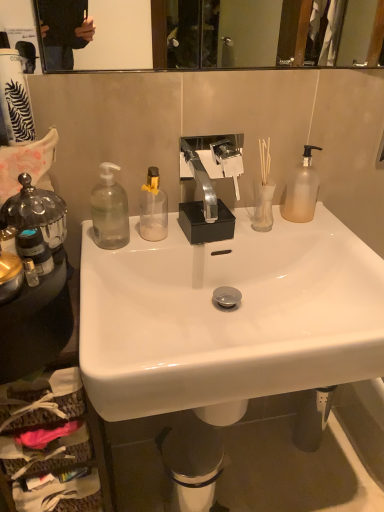
Question: Is transparent glass bottle at center, the second bottle in the left-to-right sequence, facing away from frosted glass pump bottle at upper right, which ranks as the 1th bottle in right-to-left order?

Choices:
 (A) yes
 (B) no

Answer: (B)

Question: Does transparent glass bottle at center, the second bottle in the left-to-right sequence, appear on the left side of frosted glass pump bottle at upper right, the 3th bottle from the left?

Choices:
 (A) yes
 (B) no

Answer: (A)

Question: Is transparent glass bottle at center, which ranks as the second bottle in right-to-left order, taller than frosted glass pump bottle at upper right, which ranks as the 1th bottle in right-to-left order?

Choices:
 (A) no
 (B) yes

Answer: (A)

Question: Is transparent glass bottle at center, which ranks as the second bottle in right-to-left order, shorter than frosted glass pump bottle at upper right, which ranks as the 1th bottle in right-to-left order?

Choices:
 (A) no
 (B) yes

Answer: (B)

Question: From the image's perspective, is transparent glass bottle at center, the second bottle in the left-to-right sequence, below frosted glass pump bottle at upper right, the 3th bottle from the left?

Choices:
 (A) no
 (B) yes

Answer: (B)

Question: From a real-world perspective, is transparent plastic soap dispenser at left, the third bottle in the right-to-left sequence, physically located above or below white glossy sink at center?

Choices:
 (A) above
 (B) below

Answer: (A)

Question: Considering their positions, is transparent plastic soap dispenser at left, the third bottle in the right-to-left sequence, located in front of or behind white glossy sink at center?

Choices:
 (A) front
 (B) behind

Answer: (B)

Question: Would you say transparent plastic soap dispenser at left, marked as the 1th bottle in a left-to-right arrangement, is inside or outside white glossy sink at center?

Choices:
 (A) inside
 (B) outside

Answer: (B)

Question: Considering the positions of transparent plastic soap dispenser at left, the third bottle in the right-to-left sequence, and white glossy sink at center in the image, is transparent plastic soap dispenser at left, the third bottle in the right-to-left sequence, taller or shorter than white glossy sink at center?

Choices:
 (A) short
 (B) tall

Answer: (A)

Question: From the image's perspective, is metallic trash bin at lower center located above or below white glossy sink at center?

Choices:
 (A) below
 (B) above

Answer: (A)

Question: Is metallic trash bin at lower center in front of or behind white glossy sink at center in the image?

Choices:
 (A) front
 (B) behind

Answer: (B)

Question: From a real-world perspective, relative to white glossy sink at center, is metallic trash bin at lower center vertically above or below?

Choices:
 (A) below
 (B) above

Answer: (A)

Question: Looking at the image, does metallic trash bin at lower center seem bigger or smaller compared to white glossy sink at center?

Choices:
 (A) big
 (B) small

Answer: (B)

Question: From their relative heights in the image, would you say white glossy sink at center is taller or shorter than translucent glass vase at center?

Choices:
 (A) tall
 (B) short

Answer: (A)

Question: From the image's perspective, is white glossy sink at center positioned above or below translucent glass vase at center?

Choices:
 (A) above
 (B) below

Answer: (B)